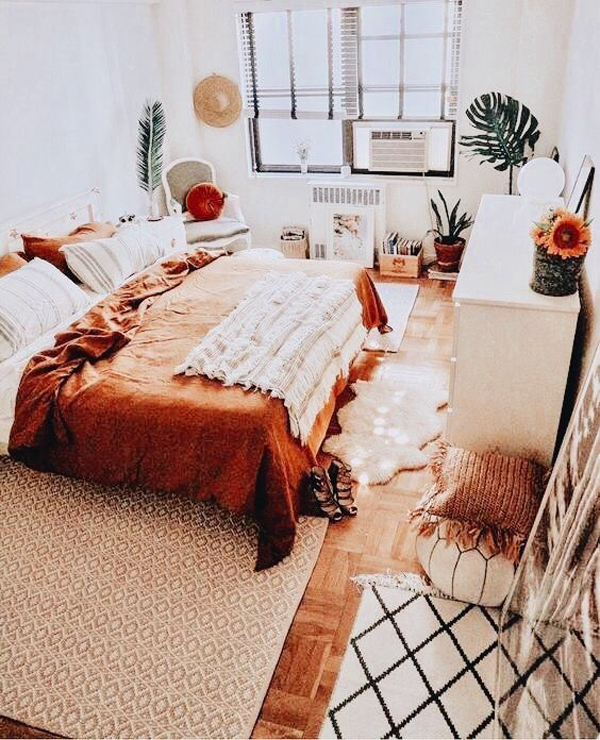
Identify the location of ac unit. This screenshot has width=600, height=740. click(x=379, y=149).